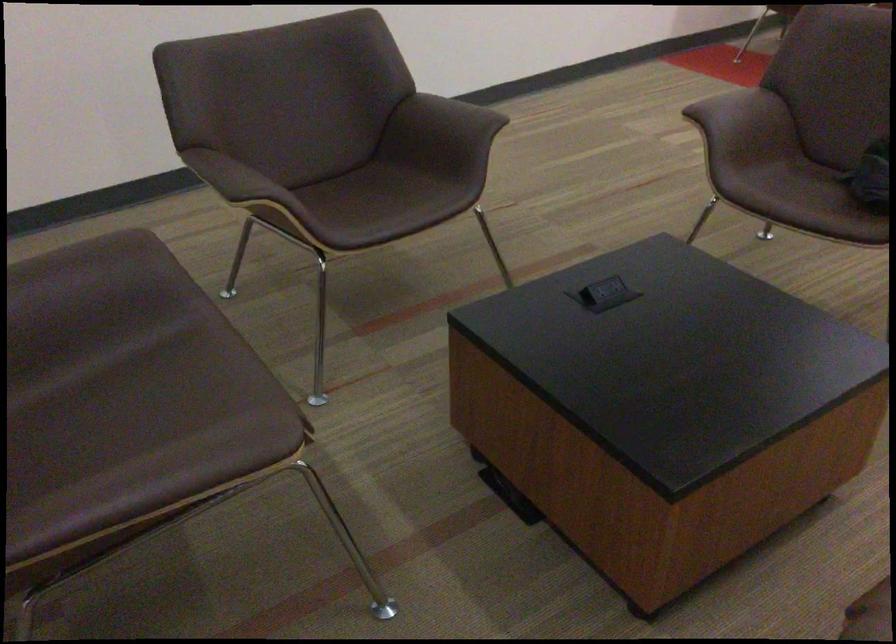
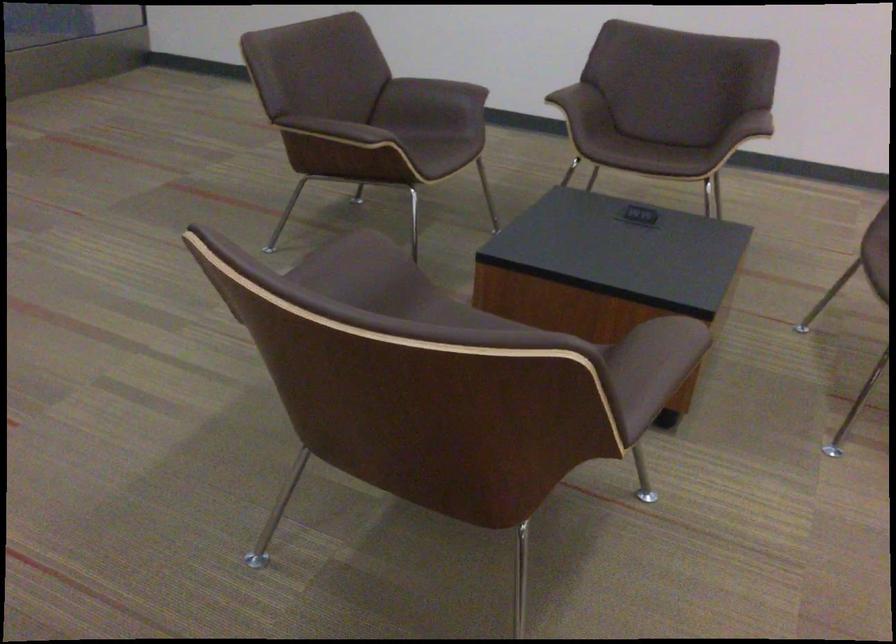
Locate, in the second image, the point that corresponds to [168,486] in the first image.

(334, 129)